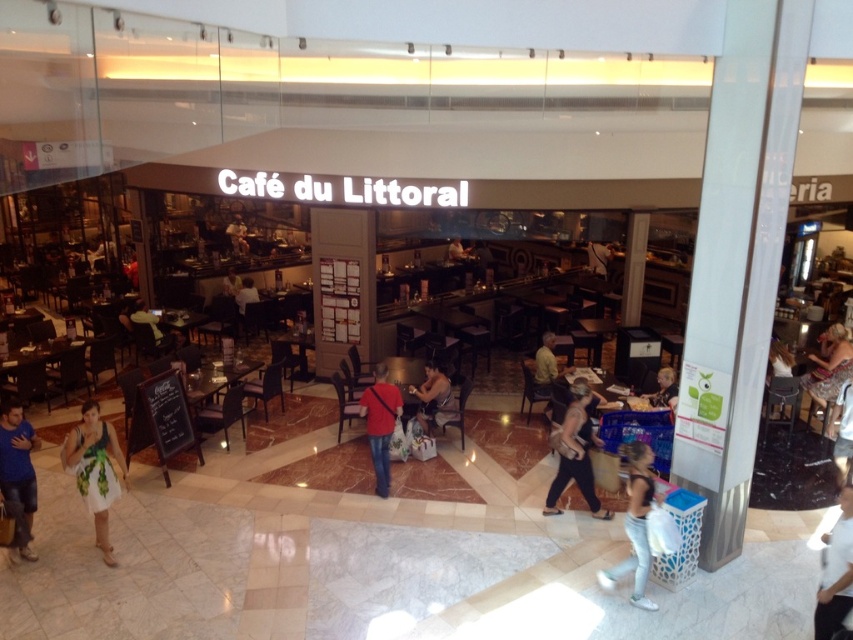
The width and height of the screenshot is (853, 640). What do you see at coordinates (96, 468) in the screenshot?
I see `white floral dress at lower left` at bounding box center [96, 468].

Is white floral dress at lower left in front of dark gray pants at center?

Yes.

Which is behind, point (99, 522) or point (556, 468)?

Point (556, 468)

At what (x,y) coordinates should I click in order to perform the action: click on white floral dress at lower left. Please return your answer as a coordinate pair (x, y). Looking at the image, I should click on (96, 468).

Can you confirm if blue denim shirt at lower left is bigger than white cotton shirt at lower right?

Incorrect, blue denim shirt at lower left is not larger than white cotton shirt at lower right.

Does blue denim shirt at lower left come behind white cotton shirt at lower right?

That is True.

Where is `blue denim shirt at lower left`? This screenshot has height=640, width=853. blue denim shirt at lower left is located at coordinates (16, 474).

Does white floral dress at lower left have a larger size compared to white cotton shirt at lower right?

Yes.

Is point (90, 436) behind point (834, 600)?

Yes, it is.

Where is `white floral dress at lower left`? The height and width of the screenshot is (640, 853). white floral dress at lower left is located at coordinates (96, 468).

Where is `white floral dress at lower left`? Image resolution: width=853 pixels, height=640 pixels. white floral dress at lower left is located at coordinates coord(96,468).